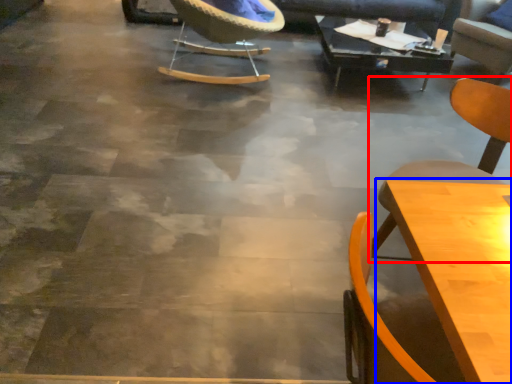
Question: Which of the following is the closest to the observer, chair (highlighted by a red box) or table (highlighted by a blue box)?

Choices:
 (A) chair
 (B) table

Answer: (B)